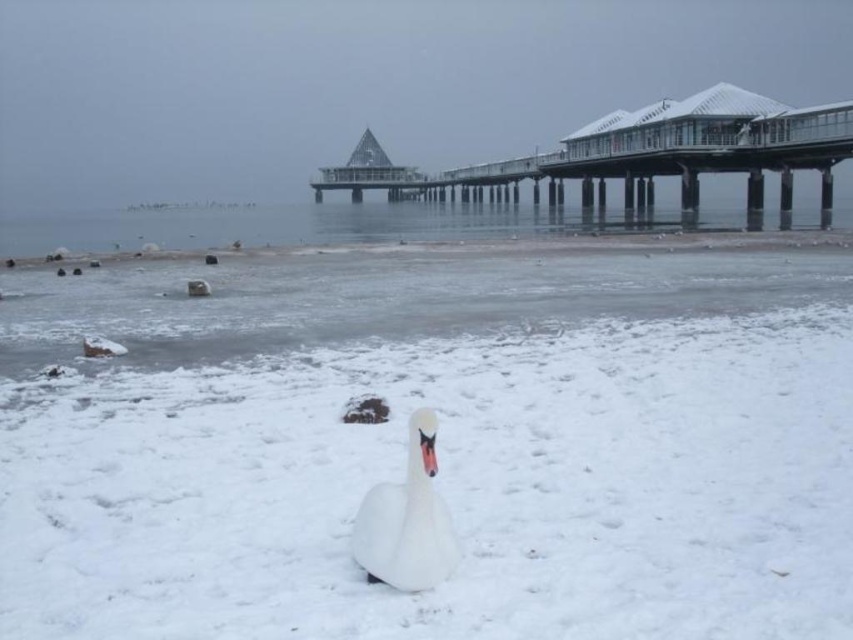
Identify the location of clear glass pier at upper center. The image size is (853, 640). (637, 156).

Who is taller, clear glass pier at upper center or white matte swan at center?

Standing taller between the two is clear glass pier at upper center.

Measure the distance between clear glass pier at upper center and camera.

A distance of 36.92 meters exists between clear glass pier at upper center and camera.

Image resolution: width=853 pixels, height=640 pixels. What are the coordinates of `clear glass pier at upper center` in the screenshot? It's located at (637, 156).

Which is more to the right, clear ice water at center or white matte swan at center?

white matte swan at center

Between point (219, 225) and point (392, 564), which one is positioned behind?

The point (219, 225) is behind.

Locate an element on the screen. clear ice water at center is located at coordinates (370, 225).

Can you confirm if clear glass pier at upper center is shorter than clear ice water at center?

No, clear glass pier at upper center is not shorter than clear ice water at center.

Which of these two, clear glass pier at upper center or clear ice water at center, stands shorter?

Standing shorter between the two is clear ice water at center.

Identify the location of clear glass pier at upper center. (637, 156).

Image resolution: width=853 pixels, height=640 pixels. What are the coordinates of `clear glass pier at upper center` in the screenshot? It's located at (637, 156).